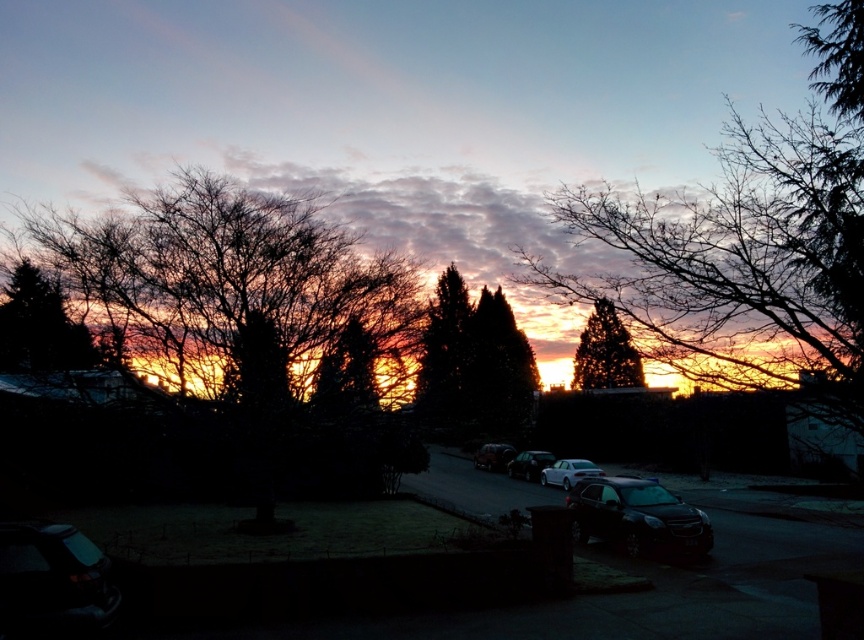
Question: Which point is closer to the camera taking this photo?

Choices:
 (A) (499, 449)
 (B) (40, 609)
 (C) (216, 276)
 (D) (437, 396)

Answer: (B)

Question: Estimate the real-world distances between objects in this image. Which object is closer to the bare branches at upper left?

Choices:
 (A) satin silver sedan at center
 (B) green matte tree at left
 (C) glossy black car at center
 (D) satin black car at center

Answer: (B)

Question: Does shiny black car at lower left appear on the right side of green matte tree at left?

Choices:
 (A) no
 (B) yes

Answer: (B)

Question: From the image, what is the correct spatial relationship of green matte tree at center in relation to satin silver sedan at center?

Choices:
 (A) below
 (B) above

Answer: (B)

Question: Among these points, which one is farthest from the camera?

Choices:
 (A) (505, 452)
 (B) (30, 580)

Answer: (A)

Question: Where is glossy black car at center located in relation to green matte tree at left in the image?

Choices:
 (A) left
 (B) right

Answer: (B)